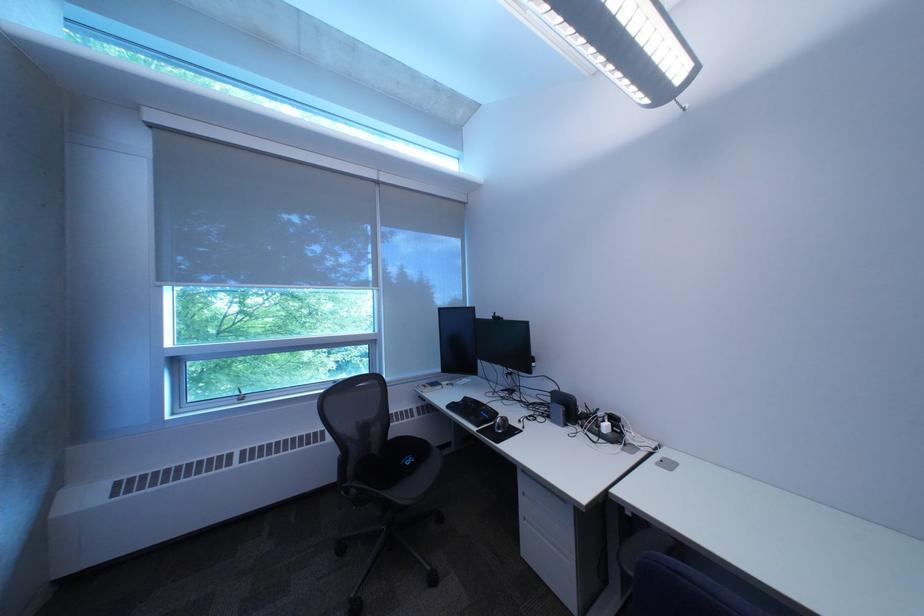
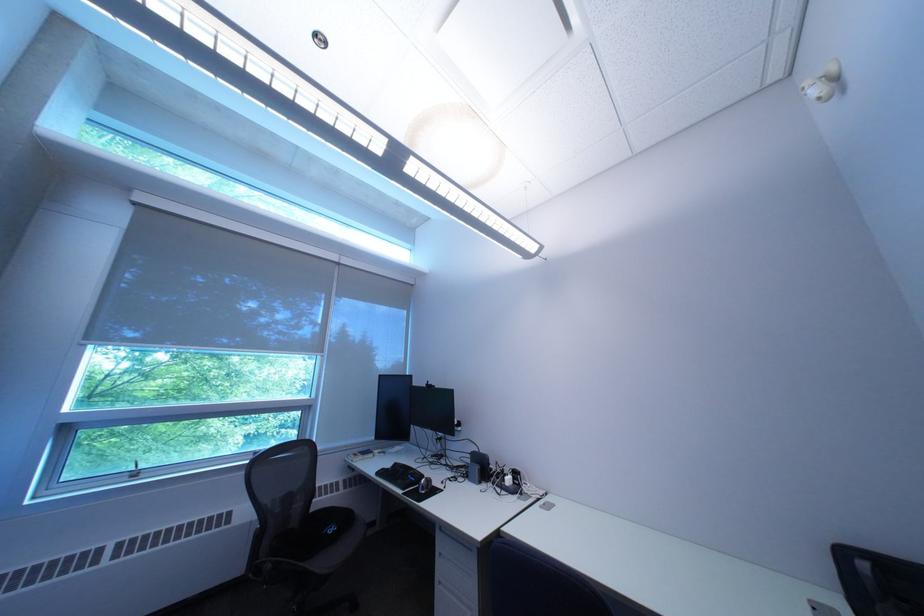
Find the pixel in the second image that matches (x=539, y=525) in the first image.

(454, 592)